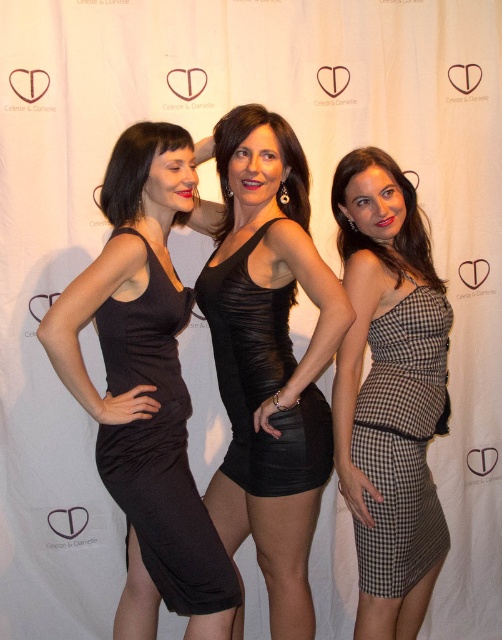
Question: Is shiny black dress at center in front of black satin dress at center?

Choices:
 (A) no
 (B) yes

Answer: (B)

Question: Is shiny black dress at center thinner than checkered fabric dress at right?

Choices:
 (A) yes
 (B) no

Answer: (B)

Question: Which of the following is the farthest from the observer?

Choices:
 (A) shiny black dress at center
 (B) checkered fabric dress at right
 (C) black satin dress at center
 (D) matte black dress at center

Answer: (B)

Question: Which is nearer to the checkered fabric dress at right?

Choices:
 (A) black satin dress at center
 (B) matte black dress at center

Answer: (A)

Question: Is matte black dress at center to the right of black satin dress at center from the viewer's perspective?

Choices:
 (A) no
 (B) yes

Answer: (A)

Question: Which object appears closest to the camera in this image?

Choices:
 (A) checkered fabric dress at right
 (B) black satin dress at center
 (C) matte black dress at center

Answer: (C)